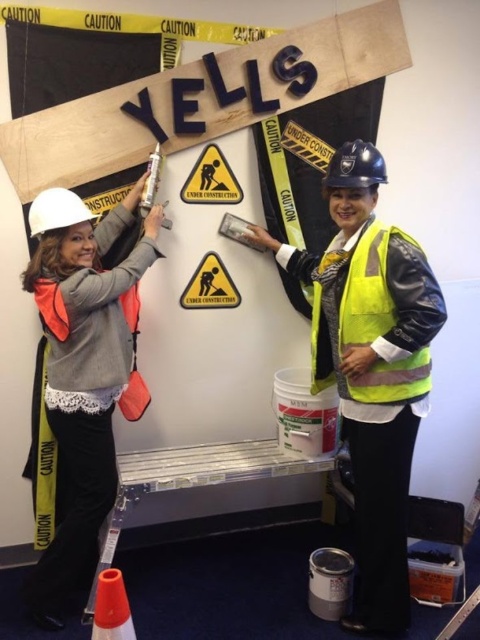
You are a safety inspector checking the setup of the construction site. You need to ensure that the yellow reflective safety vest at center and the orange reflective cone at lower left are placed appropriately. Based on their sizes, which object should be moved if there is limited space between them?

The yellow reflective safety vest at center has a larger width than the orange reflective cone at lower left. Therefore, the orange reflective cone at lower left should be moved to accommodate the space requirements of the larger vest.